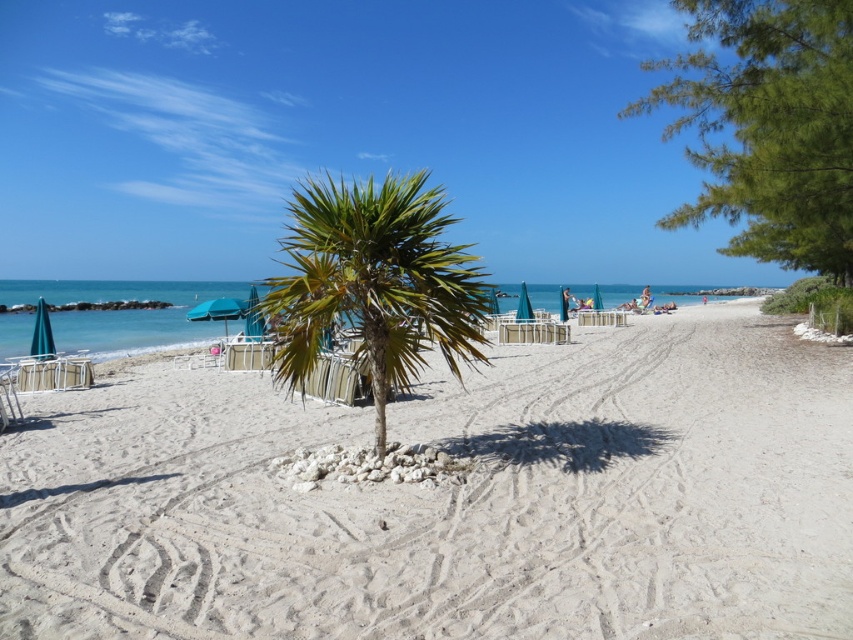
Does white sandy beach at center appear under green leafy palm tree at center?

Indeed, white sandy beach at center is positioned under green leafy palm tree at center.

Is white sandy beach at center thinner than green leafy palm tree at center?

In fact, white sandy beach at center might be wider than green leafy palm tree at center.

Describe the element at coordinates (453, 499) in the screenshot. I see `white sandy beach at center` at that location.

Where is `white sandy beach at center`? The height and width of the screenshot is (640, 853). white sandy beach at center is located at coordinates (453, 499).

Find the location of `green leafy palm tree at center`. green leafy palm tree at center is located at coordinates (374, 282).

Does green leafy palm tree at center appear on the left side of teal fabric umbrella at left?

Incorrect, green leafy palm tree at center is not on the left side of teal fabric umbrella at left.

Is point (381, 392) positioned behind point (41, 330)?

No, it is in front of (41, 330).

The image size is (853, 640). In order to click on green leafy palm tree at center in this screenshot , I will do `click(374, 282)`.

Based on the photo, does blue fabric umbrella at center have a lesser width compared to teal fabric umbrella at center?

No.

Is point (236, 307) closer to camera compared to point (531, 310)?

Yes, point (236, 307) is closer to viewer.

Locate an element on the screen. The height and width of the screenshot is (640, 853). blue fabric umbrella at center is located at coordinates (218, 310).